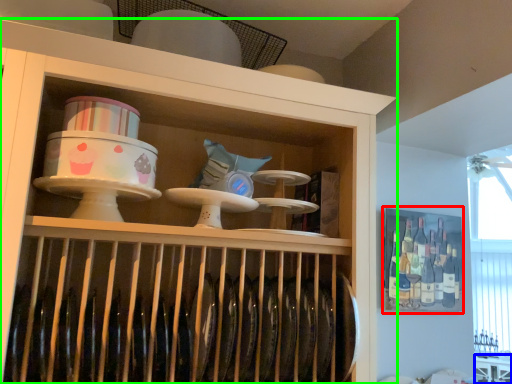
Question: Considering the real-world distances, which object is closest to cabinet (highlighted by a red box)? table (highlighted by a blue box) or shelf (highlighted by a green box).

Choices:
 (A) table
 (B) shelf

Answer: (A)